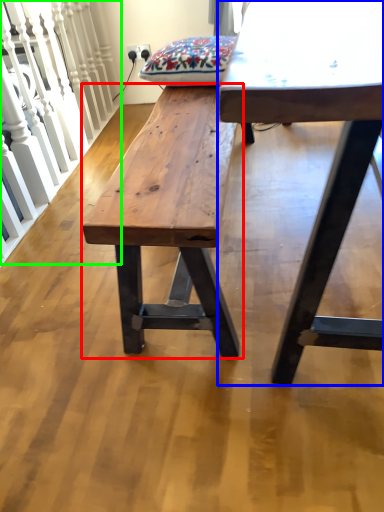
Question: Which object is the closest to the bench (highlighted by a red box)? Choose among these: table (highlighted by a blue box) or rail (highlighted by a green box).

Choices:
 (A) table
 (B) rail

Answer: (A)